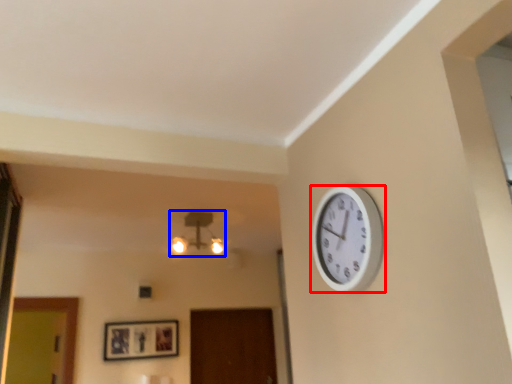
Question: Among these objects, which one is nearest to the camera, wall clock (highlighted by a red box) or lamp (highlighted by a blue box)?

Choices:
 (A) wall clock
 (B) lamp

Answer: (A)